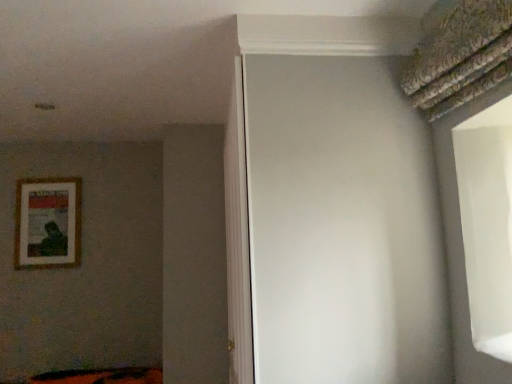
Question: Looking at their shapes, would you say white matte screen door at center is wider or thinner than wooden framed poster at left?

Choices:
 (A) wide
 (B) thin

Answer: (A)

Question: Is white matte screen door at center situated inside wooden framed poster at left or outside?

Choices:
 (A) inside
 (B) outside

Answer: (B)

Question: From their relative heights in the image, would you say white matte screen door at center is taller or shorter than wooden framed poster at left?

Choices:
 (A) short
 (B) tall

Answer: (B)

Question: From the image's perspective, is wooden framed poster at left above or below white matte screen door at center?

Choices:
 (A) below
 (B) above

Answer: (B)

Question: Considering the relative positions of wooden framed poster at left and white matte screen door at center in the image provided, is wooden framed poster at left to the left or to the right of white matte screen door at center?

Choices:
 (A) right
 (B) left

Answer: (B)

Question: Considering their positions, is wooden framed poster at left located in front of or behind white matte screen door at center?

Choices:
 (A) behind
 (B) front

Answer: (A)

Question: Is wooden framed poster at left wider or thinner than white matte screen door at center?

Choices:
 (A) wide
 (B) thin

Answer: (B)